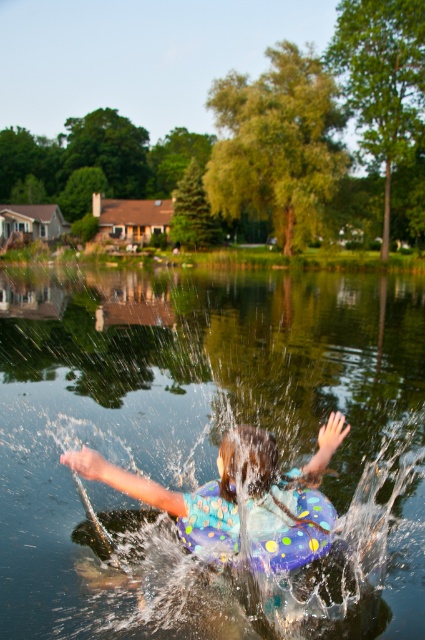
Question: Which point appears closest to the camera in this image?

Choices:
 (A) (303, 509)
 (B) (231, 524)

Answer: (B)

Question: Can you confirm if polka dot floaty at center is positioned below polka dot rubber life jacket at center?

Choices:
 (A) no
 (B) yes

Answer: (A)

Question: Which point is closer to the camera taking this photo?

Choices:
 (A) (180, 588)
 (B) (218, 522)
 (C) (112, 477)

Answer: (C)

Question: Can you confirm if polka dot floaty at center is positioned to the right of polka dot rubber life jacket at center?

Choices:
 (A) no
 (B) yes

Answer: (A)

Question: Considering the real-world distances, which object is closest to the polka dot floaty at center?

Choices:
 (A) clear water at center
 (B) polka dot rubber life jacket at center

Answer: (B)

Question: Is the position of polka dot floaty at center more distant than that of polka dot rubber life jacket at center?

Choices:
 (A) no
 (B) yes

Answer: (A)